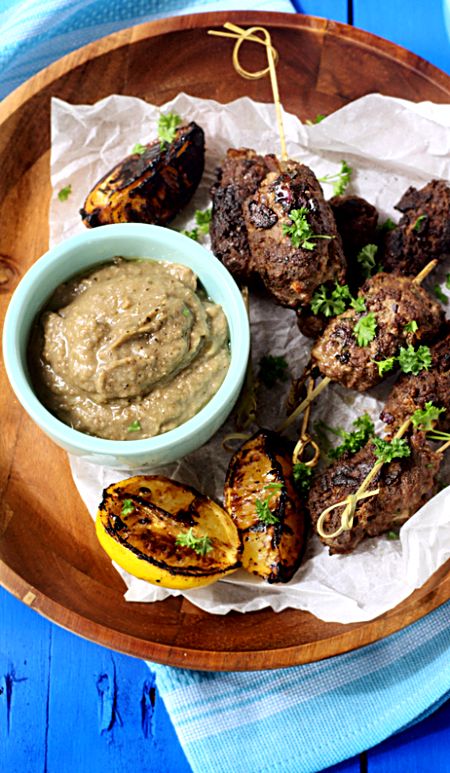
You are a GUI agent. You are given a task and a screenshot of the screen. Output one action in this format:
    pyautogui.click(x=<x>, y=<y>)
    Task: Click on the blue bench table
    
    Given the screenshot: What is the action you would take?
    pyautogui.click(x=377, y=26)